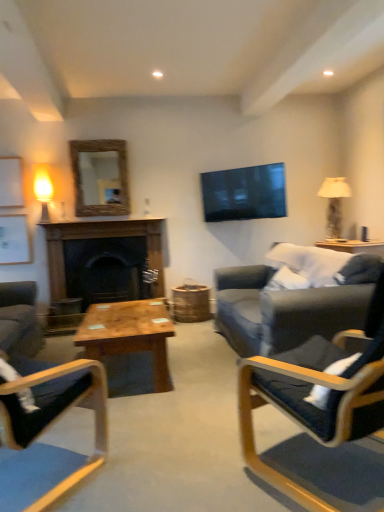
What do you see at coordinates (100, 237) in the screenshot?
I see `dark wood fireplace at center` at bounding box center [100, 237].

Image resolution: width=384 pixels, height=512 pixels. What do you see at coordinates (46, 444) in the screenshot?
I see `wooden armchair at center, which appears as the second chair when viewed from the right` at bounding box center [46, 444].

Looking at this image, measure the distance between rustic wood mirror at upper center and camera.

rustic wood mirror at upper center and camera are 14.95 feet apart.

What do you see at coordinates (334, 203) in the screenshot? The height and width of the screenshot is (512, 384). I see `white fabric lampshade at right, positioned as the 2th lamp in left-to-right order` at bounding box center [334, 203].

What do you see at coordinates (318, 387) in the screenshot? I see `matte black chair at right, placed as the 1th chair when sorted from right to left` at bounding box center [318, 387].

What is the approximate width of wooden coffee table at center?

wooden coffee table at center is 24.66 inches wide.

At what (x,y) coordinates should I click in order to perform the action: click on matte glass lamp at left, placed as the 2th lamp when sorted from right to left. Please return your answer as a coordinate pair (x, y). Looking at the image, I should click on (43, 190).

At what (x,y) coordinates should I click in order to perform the action: click on dark wood fireplace at center. Please return your answer as a coordinate pair (x, y). The image size is (384, 512). Looking at the image, I should click on (100, 237).

Is matte black chair at right, the second chair viewed from the left, aimed at wooden armchair at center, the first chair viewed from the left?

No, matte black chair at right, the second chair viewed from the left, is not turned towards wooden armchair at center, the first chair viewed from the left.

From a real-world perspective, which is physically above, matte black chair at right, placed as the 1th chair when sorted from right to left, or wooden armchair at center, the first chair viewed from the left?

wooden armchair at center, the first chair viewed from the left.

In the image, there is a wooden armchair at center, which appears as the second chair when viewed from the right. Identify the location of chair above it (from the image's perspective). (318, 387).

Is matte black chair at right, the second chair viewed from the left, with wooden armchair at center, the first chair viewed from the left?

matte black chair at right, the second chair viewed from the left, is not next to wooden armchair at center, the first chair viewed from the left, and they're not touching.

From the image's perspective, does matte glass lamp at left, which is the first lamp from left to right, appear lower than wooden coffee table at center?

Actually, matte glass lamp at left, which is the first lamp from left to right, appears above wooden coffee table at center in the image.

This screenshot has height=512, width=384. Find the location of `lamp lying on the left of wooden coffee table at center`. lamp lying on the left of wooden coffee table at center is located at coordinates (43, 190).

Considering the sizes of objects matte glass lamp at left, which is the first lamp from left to right, and wooden coffee table at center in the image provided, who is taller, matte glass lamp at left, which is the first lamp from left to right, or wooden coffee table at center?

Standing taller between the two is matte glass lamp at left, which is the first lamp from left to right.

Is matte glass lamp at left, which is the first lamp from left to right, far away from rustic wood mirror at upper center?

Actually, matte glass lamp at left, which is the first lamp from left to right, and rustic wood mirror at upper center are a little close together.

Does matte glass lamp at left, placed as the 2th lamp when sorted from right to left, have a smaller size compared to rustic wood mirror at upper center?

Indeed, matte glass lamp at left, placed as the 2th lamp when sorted from right to left, has a smaller size compared to rustic wood mirror at upper center.

Does matte glass lamp at left, placed as the 2th lamp when sorted from right to left, turn towards rustic wood mirror at upper center?

No, matte glass lamp at left, placed as the 2th lamp when sorted from right to left, is not turned towards rustic wood mirror at upper center.

Looking at this image, can you tell me how much matte glass lamp at left, which is the first lamp from left to right, and rustic wood mirror at upper center differ in facing direction?

The angular difference between matte glass lamp at left, which is the first lamp from left to right, and rustic wood mirror at upper center is 0.000147 degrees.

Is dark wood fireplace at center completely or partially outside of white fabric lampshade at right, positioned as the 2th lamp in left-to-right order?

Yes, dark wood fireplace at center is outside of white fabric lampshade at right, positioned as the 2th lamp in left-to-right order.

Does point (60, 225) lie in front of point (338, 227)?

Yes, it is.

Is dark wood fireplace at center closer to the viewer compared to white fabric lampshade at right, positioned as the 2th lamp in left-to-right order?

Yes, it is in front of white fabric lampshade at right, positioned as the 2th lamp in left-to-right order.

Where is `fireplace below the white fabric lampshade at right, positioned as the 2th lamp in left-to-right order (from the image's perspective)`? The width and height of the screenshot is (384, 512). fireplace below the white fabric lampshade at right, positioned as the 2th lamp in left-to-right order (from the image's perspective) is located at coordinates (100, 237).

Based on the photo, is white fabric lampshade at right, which is the 1th lamp in right-to-left order, oriented away from wooden coffee table at center?

No, white fabric lampshade at right, which is the 1th lamp in right-to-left order, is not facing away from wooden coffee table at center.

Considering the relative sizes of white fabric lampshade at right, positioned as the 2th lamp in left-to-right order, and wooden coffee table at center in the image provided, is white fabric lampshade at right, positioned as the 2th lamp in left-to-right order, taller than wooden coffee table at center?

Indeed, white fabric lampshade at right, positioned as the 2th lamp in left-to-right order, has a greater height compared to wooden coffee table at center.

Locate an element on the screen. The image size is (384, 512). coffee table that is on the left side of white fabric lampshade at right, positioned as the 2th lamp in left-to-right order is located at coordinates (129, 334).

How different are the orientations of white fabric lampshade at right, positioned as the 2th lamp in left-to-right order, and wooden coffee table at center in degrees?

177 degrees separate the facing orientations of white fabric lampshade at right, positioned as the 2th lamp in left-to-right order, and wooden coffee table at center.

Which object is wider, white fabric lampshade at right, which is the 1th lamp in right-to-left order, or dark wood fireplace at center?

white fabric lampshade at right, which is the 1th lamp in right-to-left order.

Between white fabric lampshade at right, which is the 1th lamp in right-to-left order, and dark wood fireplace at center, which one has more height?

Standing taller between the two is dark wood fireplace at center.

Does white fabric lampshade at right, which is the 1th lamp in right-to-left order, have a smaller size compared to dark wood fireplace at center?

Indeed, white fabric lampshade at right, which is the 1th lamp in right-to-left order, has a smaller size compared to dark wood fireplace at center.

From a real-world perspective, is white fabric lampshade at right, which is the 1th lamp in right-to-left order, over dark wood fireplace at center?

Correct, in the physical world, white fabric lampshade at right, which is the 1th lamp in right-to-left order, is higher than dark wood fireplace at center.

Is wooden armchair at center, the first chair viewed from the left, smaller than matte black chair at right, the second chair viewed from the left?

Indeed, wooden armchair at center, the first chair viewed from the left, has a smaller size compared to matte black chair at right, the second chair viewed from the left.

Is wooden armchair at center, the first chair viewed from the left, looking in the opposite direction of matte black chair at right, the second chair viewed from the left?

wooden armchair at center, the first chair viewed from the left, does not have its back to matte black chair at right, the second chair viewed from the left.

How far apart are wooden armchair at center, which appears as the second chair when viewed from the right, and matte black chair at right, placed as the 1th chair when sorted from right to left?

A distance of 33.45 inches exists between wooden armchair at center, which appears as the second chair when viewed from the right, and matte black chair at right, placed as the 1th chair when sorted from right to left.

Identify the location of chair below the wooden armchair at center, the first chair viewed from the left (from a real-world perspective). Image resolution: width=384 pixels, height=512 pixels. (318, 387).

Locate an element on the screen. coffee table that appears in front of the matte glass lamp at left, placed as the 2th lamp when sorted from right to left is located at coordinates (129, 334).

Which object lies further to the anchor point white fabric lampshade at right, which is the 1th lamp in right-to-left order, wooden coffee table at center or matte black chair at right, placed as the 1th chair when sorted from right to left?

The object further to white fabric lampshade at right, which is the 1th lamp in right-to-left order, is matte black chair at right, placed as the 1th chair when sorted from right to left.

When comparing their distances from dark wood fireplace at center, does wooden coffee table at center or matte glass lamp at left, placed as the 2th lamp when sorted from right to left, seem further?

Among the two, wooden coffee table at center is located further to dark wood fireplace at center.

Estimate the real-world distances between objects in this image. Which object is closer to wooden coffee table at center, matte black chair at right, the second chair viewed from the left, or dark wood fireplace at center?

matte black chair at right, the second chair viewed from the left.

When comparing their distances from wooden coffee table at center, does wooden armchair at center, which appears as the second chair when viewed from the right, or rustic wood mirror at upper center seem closer?

Among the two, wooden armchair at center, which appears as the second chair when viewed from the right, is located nearer to wooden coffee table at center.

Considering their positions, is rustic wood mirror at upper center positioned further to matte glass lamp at left, which is the first lamp from left to right, than wooden armchair at center, which appears as the second chair when viewed from the right?

Among the two, wooden armchair at center, which appears as the second chair when viewed from the right, is located further to matte glass lamp at left, which is the first lamp from left to right.

When comparing their distances from rustic wood mirror at upper center, does wooden armchair at center, which appears as the second chair when viewed from the right, or wooden coffee table at center seem further?

Based on the image, wooden armchair at center, which appears as the second chair when viewed from the right, appears to be further to rustic wood mirror at upper center.

Considering their positions, is matte black chair at right, placed as the 1th chair when sorted from right to left, positioned closer to rustic wood mirror at upper center than dark wood fireplace at center?

dark wood fireplace at center is closer to rustic wood mirror at upper center.

Based on their spatial positions, is rustic wood mirror at upper center or matte black chair at right, the second chair viewed from the left, closer to wooden armchair at center, which appears as the second chair when viewed from the right?

matte black chair at right, the second chair viewed from the left.

You are a GUI agent. You are given a task and a screenshot of the screen. Output one action in this format:
    pyautogui.click(x=<x>, y=<y>)
    Task: Click on the chair between matte black chair at right, the second chair viewed from the left, and matte glass lamp at left, which is the first lamp from left to right, along the z-axis
    This screenshot has width=384, height=512.
    Given the screenshot: What is the action you would take?
    pyautogui.click(x=46, y=444)

This screenshot has height=512, width=384. I want to click on coffee table located between wooden armchair at center, which appears as the second chair when viewed from the right, and white fabric lampshade at right, positioned as the 2th lamp in left-to-right order, in the depth direction, so click(x=129, y=334).

Locate an element on the screen. The width and height of the screenshot is (384, 512). coffee table between wooden armchair at center, the first chair viewed from the left, and rustic wood mirror at upper center from front to back is located at coordinates tap(129, 334).

Where is `fireplace between matte black chair at right, the second chair viewed from the left, and rustic wood mirror at upper center, along the z-axis`? fireplace between matte black chair at right, the second chair viewed from the left, and rustic wood mirror at upper center, along the z-axis is located at coordinates (100, 237).